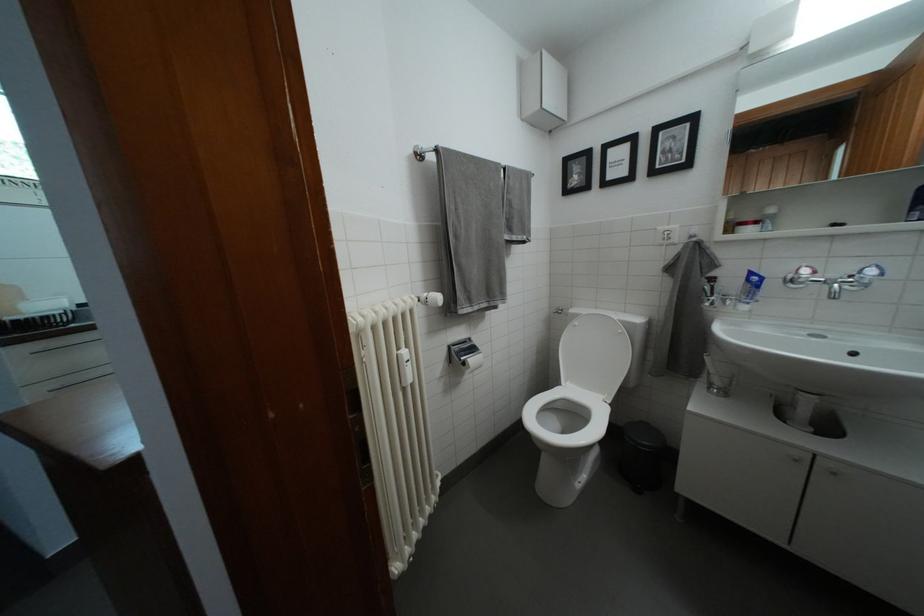
In order to click on white toilet lid in this screenshot , I will do `click(593, 354)`.